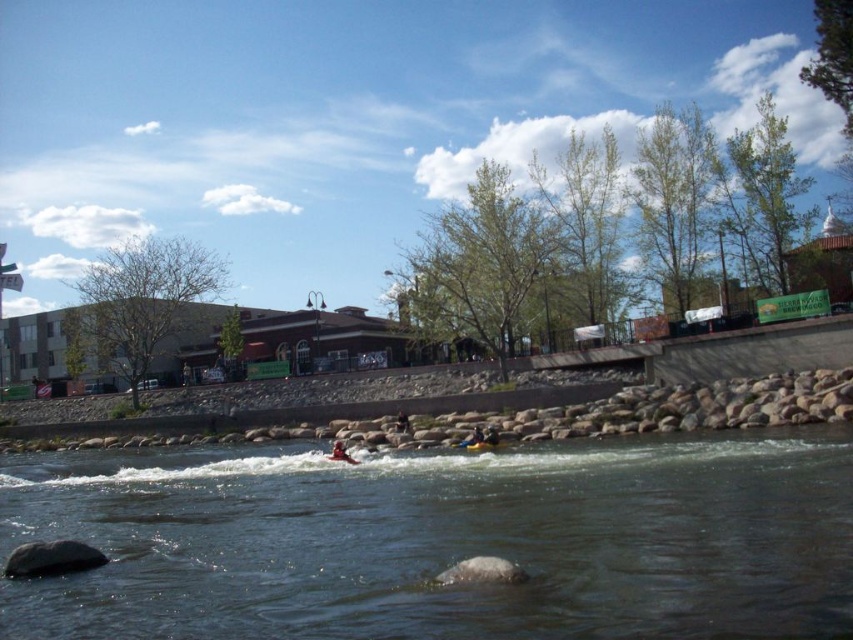
From the picture: You are standing at the origin point of the coordinate system in the image, which is the bottom left corner. You need to locate the orange life jacket at center. What are its coordinates?

The orange life jacket at center is located at coordinates point [340,452].

You are standing on the walkway and want to cross to the other side of the river. The yellow rubber boat at center is available. Can you use it to reach the clear water at center?

The clear water at center is to the left of the yellow rubber boat at center, so you can use the yellow rubber boat at center to reach the clear water at center by moving left.